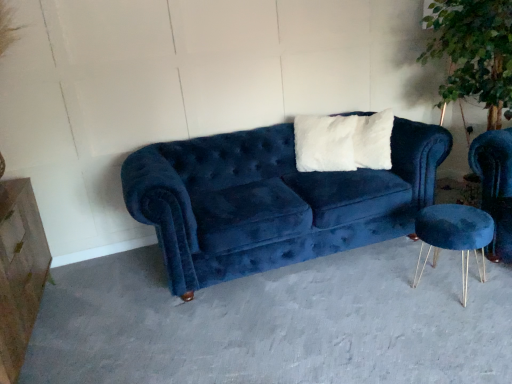
Question: Is white fluffy pillow at center wider than velvet blue couch at center?

Choices:
 (A) no
 (B) yes

Answer: (A)

Question: From a real-world perspective, is white fluffy pillow at center positioned under velvet blue couch at center based on gravity?

Choices:
 (A) no
 (B) yes

Answer: (A)

Question: Is white fluffy pillow at center looking in the opposite direction of velvet blue couch at center?

Choices:
 (A) no
 (B) yes

Answer: (A)

Question: Is the depth of white fluffy pillow at center greater than that of velvet blue couch at center?

Choices:
 (A) no
 (B) yes

Answer: (B)

Question: From a real-world perspective, is white fluffy pillow at center located higher than velvet blue couch at center?

Choices:
 (A) yes
 (B) no

Answer: (A)

Question: Is velvet blue couch at center located within white fluffy pillow at center?

Choices:
 (A) no
 (B) yes

Answer: (A)

Question: From the image's perspective, does velvet blue couch at center appear higher than white fluffy pillow at center?

Choices:
 (A) no
 (B) yes

Answer: (A)

Question: Is velvet blue couch at center not near white fluffy pillow at center?

Choices:
 (A) no
 (B) yes

Answer: (A)

Question: Does velvet blue couch at center contain white fluffy pillow at center?

Choices:
 (A) no
 (B) yes

Answer: (A)

Question: Is velvet blue couch at center bigger than white fluffy pillow at center?

Choices:
 (A) yes
 (B) no

Answer: (A)

Question: Considering the relative positions of velvet blue couch at center and white fluffy pillow at center in the image provided, is velvet blue couch at center to the left of white fluffy pillow at center from the viewer's perspective?

Choices:
 (A) no
 (B) yes

Answer: (B)

Question: From a real-world perspective, is velvet blue couch at center positioned over white fluffy pillow at center based on gravity?

Choices:
 (A) yes
 (B) no

Answer: (B)

Question: Does marble/stone dresser at left come behind green leafy plant at upper right?

Choices:
 (A) yes
 (B) no

Answer: (B)